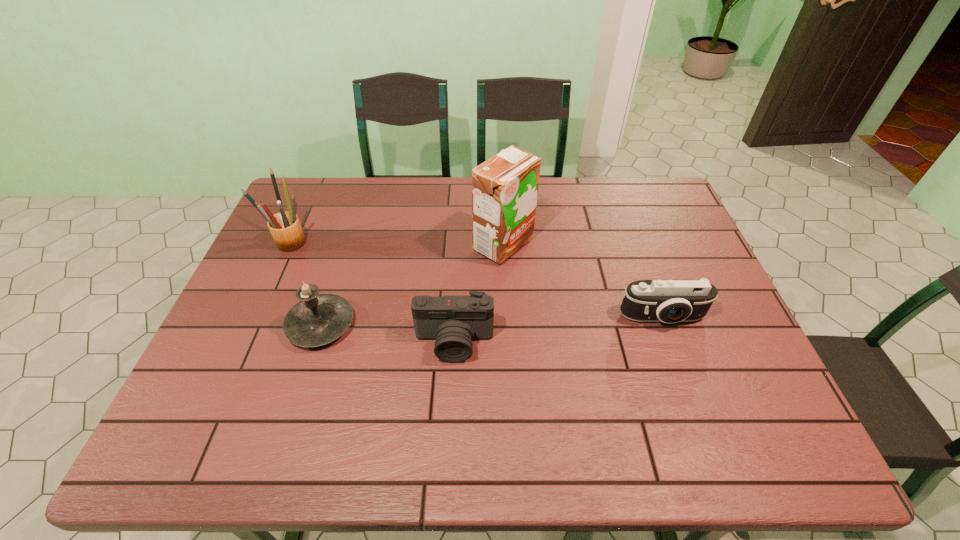
This screenshot has width=960, height=540. Identify the location of free location at the right edge. (678, 324).

At what (x,y) coordinates should I click in order to perform the action: click on blank space at the near right corner of the desktop. Please return your answer as a coordinate pair (x, y). The width and height of the screenshot is (960, 540). Looking at the image, I should click on (756, 460).

Identify the location of unoccupied area between the right camera and the left camera. (559, 330).

I want to click on vacant point located between the fourth shortest object and the rightmost object, so click(x=477, y=280).

The height and width of the screenshot is (540, 960). What are the coordinates of `free space between the rightmost object and the carton` in the screenshot? It's located at (583, 281).

Locate an element on the screen. vacant point located between the pencil box and the rightmost object is located at coordinates (477, 280).

Where is `free space between the right camera and the left camera`? The image size is (960, 540). free space between the right camera and the left camera is located at coordinates (559, 330).

Locate an element on the screen. vacant region between the second object from left to right and the carton is located at coordinates (412, 285).

The image size is (960, 540). I want to click on vacant space that's between the right camera and the left camera, so click(559, 330).

This screenshot has width=960, height=540. In order to click on vacant area between the carton and the leftmost object in this screenshot , I will do `click(397, 243)`.